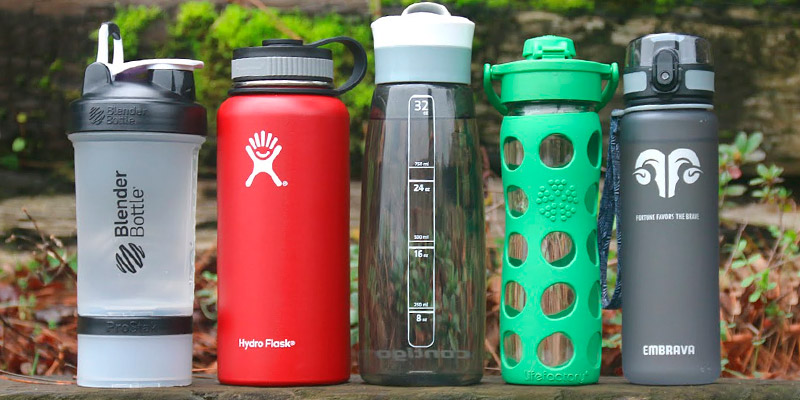
You are a GUI agent. You are given a task and a screenshot of the screen. Output one action in this format:
    pyautogui.click(x=<x>, y=<y>)
    Task: Click on the handles
    This screenshot has height=400, width=800.
    Given the screenshot: What is the action you would take?
    pyautogui.click(x=361, y=49), pyautogui.click(x=157, y=62), pyautogui.click(x=440, y=5), pyautogui.click(x=481, y=94), pyautogui.click(x=614, y=159)